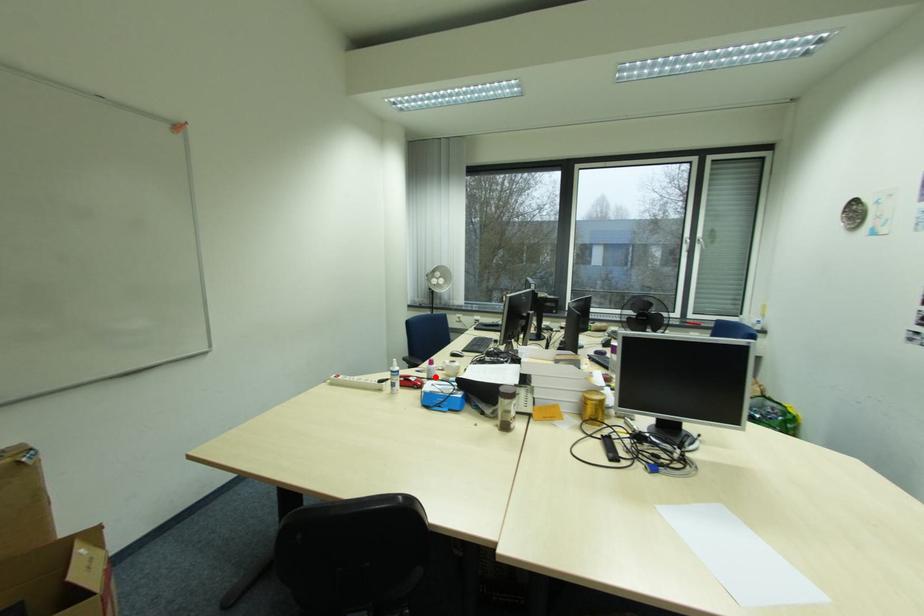
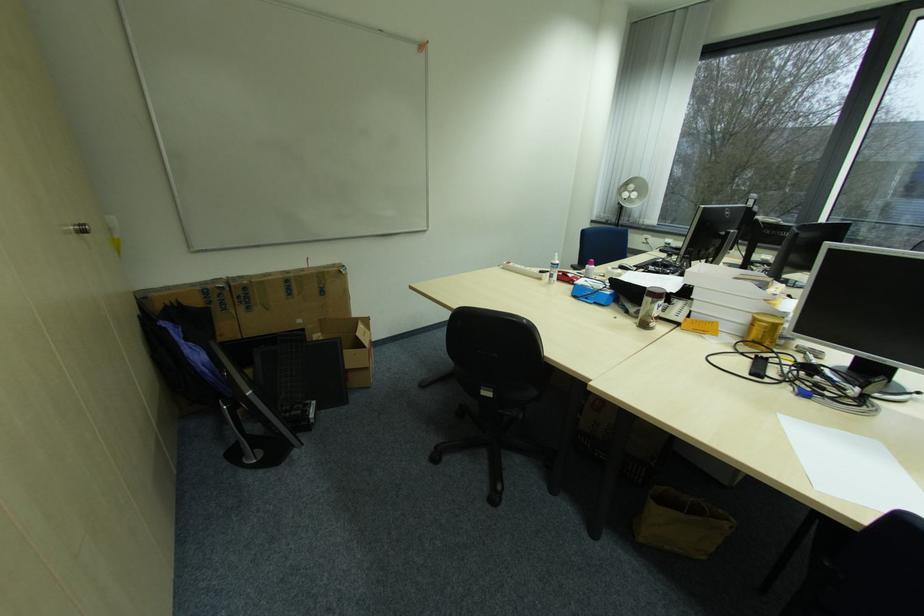
Where in the second image is the point corresponding to the highlighted location from the first image?

(592, 276)